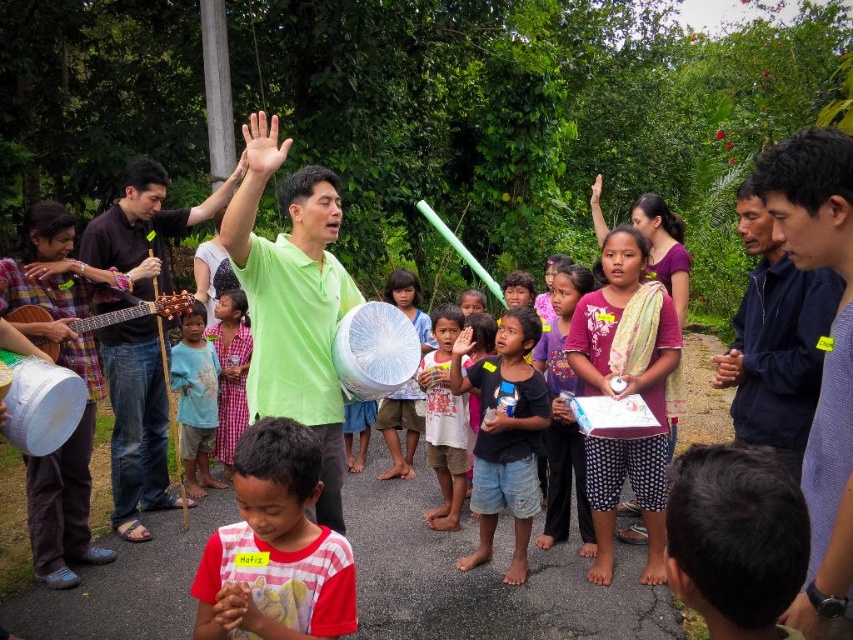
Question: Does dark blue jacket at right appear on the left side of blue plaid shirt at center?

Choices:
 (A) yes
 (B) no

Answer: (B)

Question: Based on their relative distances, which object is farther from the matte plastic plate at center?

Choices:
 (A) dark blue jacket at right
 (B) striped cotton shirt at lower left
 (C) blue cotton shirt at center

Answer: (B)

Question: Can you confirm if matte pink shirt at center is wider than matte wooden guitar at left?

Choices:
 (A) no
 (B) yes

Answer: (A)

Question: Which of these objects is positioned farthest from the matte black shirt at center?

Choices:
 (A) dark blue fabric at center
 (B) dark brown leather guitar at left
 (C) brown hair at lower right
 (D) matte pink shirt at center

Answer: (C)

Question: In this image, where is dark blue jacket at right located relative to blue plaid shirt at center?

Choices:
 (A) above
 (B) below

Answer: (A)

Question: Which point is farther to the camera?

Choices:
 (A) (224, 465)
 (B) (329, 406)
 (C) (572, 275)
 (D) (291, 616)

Answer: (A)